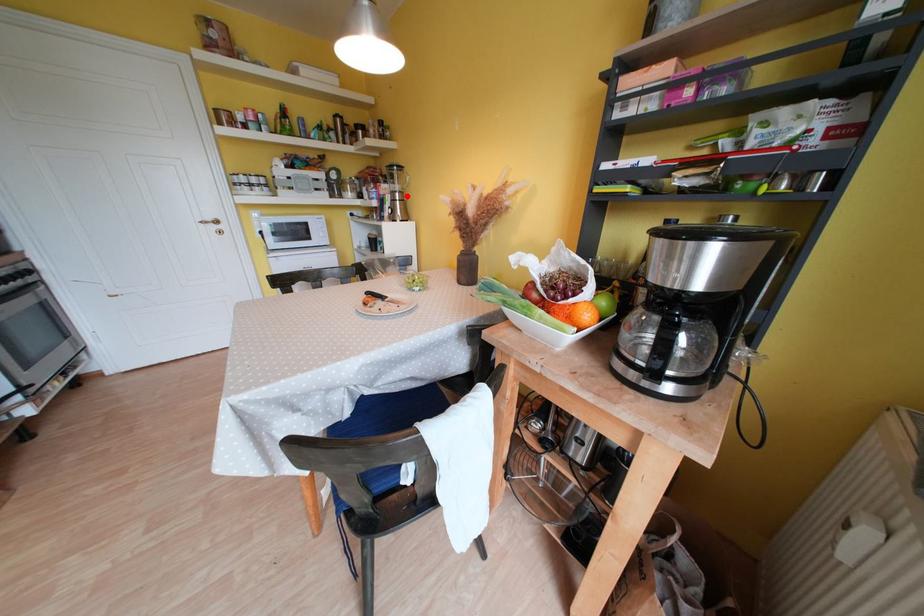
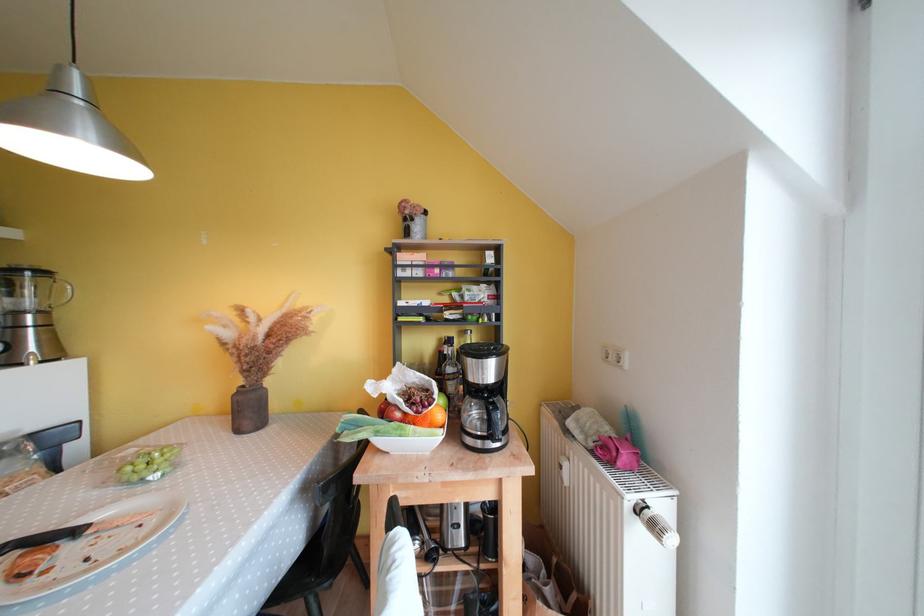
The point at the highlighted location is marked in the first image. Where is the corresponding point in the second image?

(49, 315)